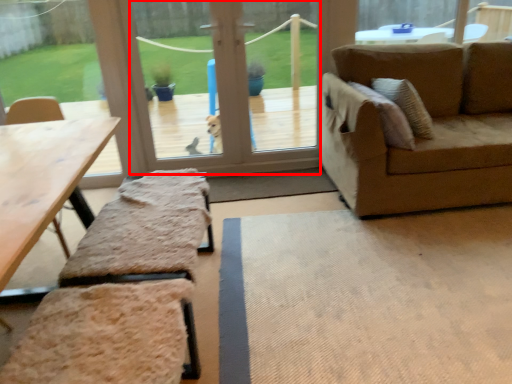
Question: Observing the image, what is the correct spatial positioning of window screen (annotated by the red box) in reference to picnic table?

Choices:
 (A) left
 (B) right

Answer: (B)